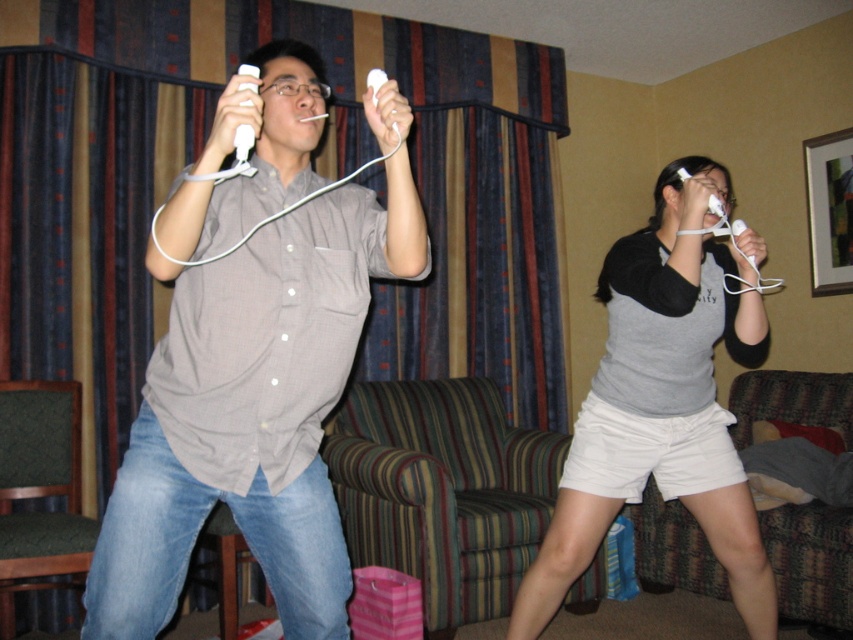
Who is positioned more to the left, matte gray shirt at center or gray cotton shirt at center?

From the viewer's perspective, matte gray shirt at center appears more on the left side.

Is matte gray shirt at center positioned before gray cotton shirt at center?

Yes, it is in front of gray cotton shirt at center.

This screenshot has width=853, height=640. Find the location of `matte gray shirt at center`. matte gray shirt at center is located at coordinates (254, 404).

Is point (523, 632) closer to viewer compared to point (250, 129)?

No, (523, 632) is further to viewer.

Can you confirm if gray cotton shirt at center is taller than white matte remote at upper center?

Indeed, gray cotton shirt at center has a greater height compared to white matte remote at upper center.

This screenshot has width=853, height=640. What are the coordinates of `gray cotton shirt at center` in the screenshot? It's located at (660, 403).

Who is lower down, matte gray shirt at center or white matte remote at upper center?

matte gray shirt at center is lower down.

Measure the distance between point (x=231, y=470) and camera.

Point (x=231, y=470) is 4.96 feet away from camera.

This screenshot has height=640, width=853. What are the coordinates of `matte gray shirt at center` in the screenshot? It's located at (254, 404).